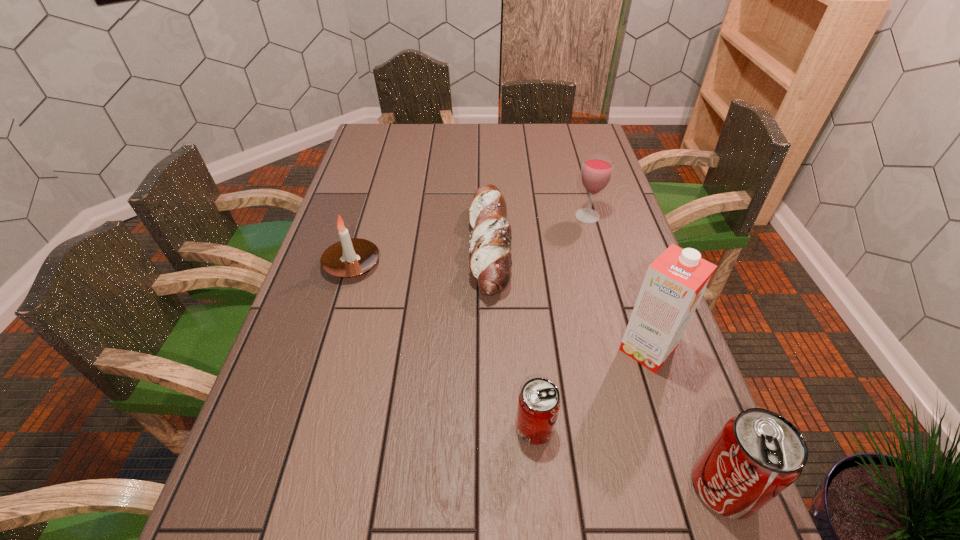
Observe the arrangement of all pop sodas in the image. To keep them evenly spaced, where would you place another pop soda on the left? Please locate a free space. Please provide its 2D coordinates. Your answer should be formatted as a tuple, i.e. [(x, y)], where the tuple contains the x and y coordinates of a point satisfying the conditions above.

[(377, 379)]